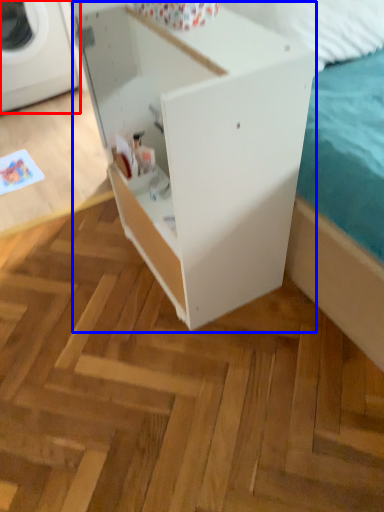
Question: Which point is further to the camera, washing machine (highlighted by a red box) or furniture (highlighted by a blue box)?

Choices:
 (A) washing machine
 (B) furniture

Answer: (A)